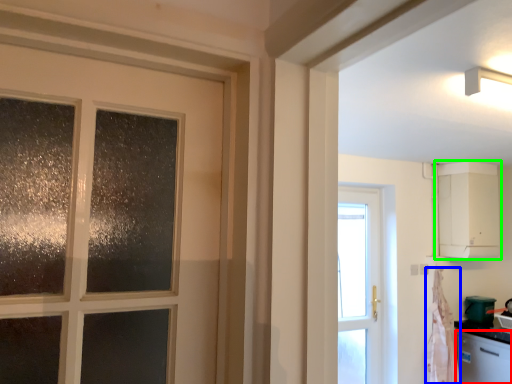
Question: Which object is the farthest from dish washer (highlighted by a red box)? Choose among these: curtain (highlighted by a blue box) or cabinetry (highlighted by a green box).

Choices:
 (A) curtain
 (B) cabinetry

Answer: (B)